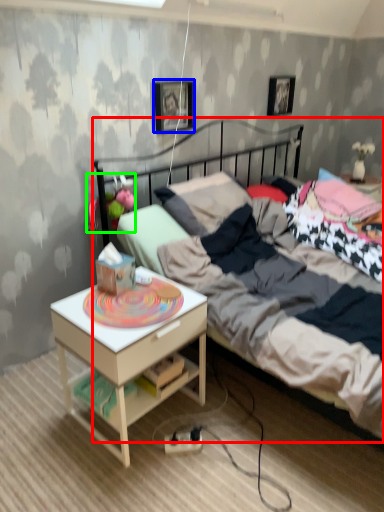
Question: Considering the real-world distances, which object is closest to bed (highlighted by a red box)? picture frame (highlighted by a blue box) or toy (highlighted by a green box).

Choices:
 (A) picture frame
 (B) toy

Answer: (B)